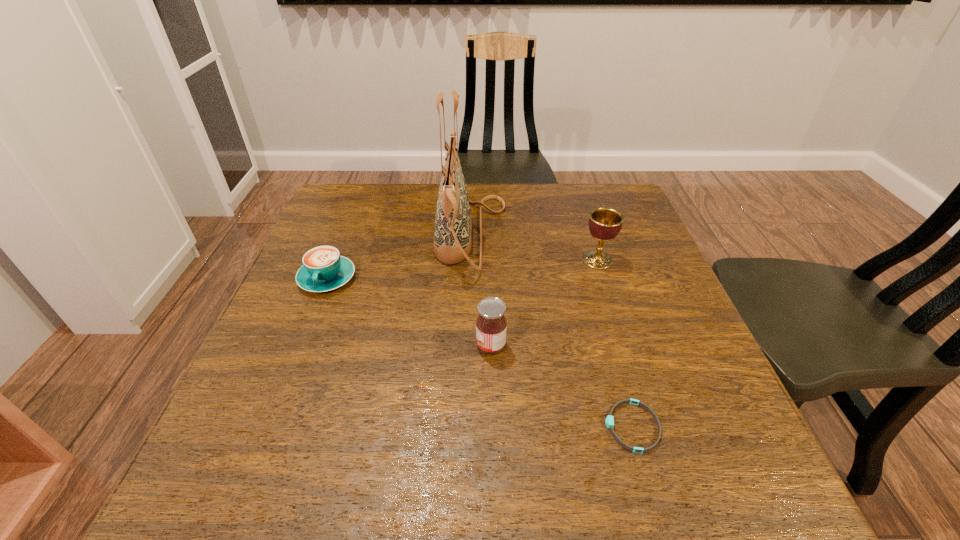
The height and width of the screenshot is (540, 960). In order to click on empty space between the chalice and the handbag in this screenshot , I will do `click(535, 248)`.

Identify the location of object that is the third closest to the tallest object. (605, 223).

Select which object appears as the closest to the jam. Please provide its 2D coordinates. Your answer should be formatted as a tuple, i.e. [(x, y)], where the tuple contains the x and y coordinates of a point satisfying the conditions above.

[(453, 224)]

Locate an element on the screen. The width and height of the screenshot is (960, 540). blank area in the image that satisfies the following two spatial constraints: 1. on the front side of the chalice; 2. on the buckle of the wristband is located at coordinates (651, 427).

You are a GUI agent. You are given a task and a screenshot of the screen. Output one action in this format:
    pyautogui.click(x=<x>, y=<y>)
    Task: Click on the free space that satisfies the following two spatial constraints: 1. on the front-facing side of the tallest object; 2. on the left side of the chalice
    Image resolution: width=960 pixels, height=540 pixels.
    Given the screenshot: What is the action you would take?
    pyautogui.click(x=470, y=260)